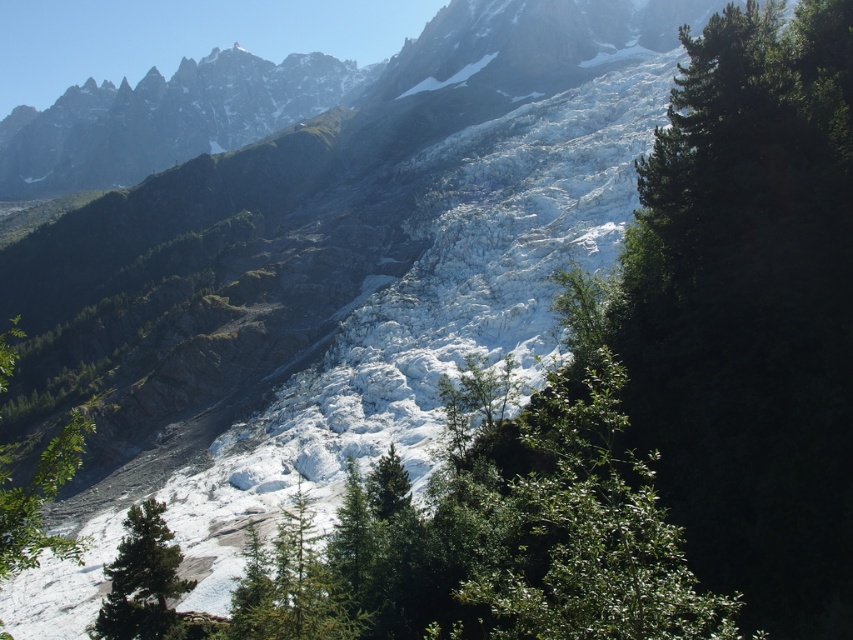
Is green needle-like tree at center to the right of green matte tree at center from the viewer's perspective?

No, green needle-like tree at center is not to the right of green matte tree at center.

Does green needle-like tree at center appear under green matte tree at center?

Yes.

Measure the distance between point (299, 515) and camera.

Point (299, 515) and camera are 247.82 feet apart from each other.

I want to click on green needle-like tree at center, so click(x=289, y=586).

Does green leafy tree at left have a lesser height compared to green matte tree at center?

In fact, green leafy tree at left may be taller than green matte tree at center.

Is point (16, 496) closer to camera compared to point (373, 477)?

Yes, point (16, 496) is in front of point (373, 477).

Identify the location of green leafy tree at left. Image resolution: width=853 pixels, height=640 pixels. (39, 500).

Can you confirm if green needle-like tree at center is taller than green leafy tree at left?

No, green needle-like tree at center is not taller than green leafy tree at left.

Who is more forward, (317, 595) or (51, 490)?

Point (51, 490) is in front.

Where is `green needle-like tree at center`? The height and width of the screenshot is (640, 853). green needle-like tree at center is located at coordinates (289, 586).